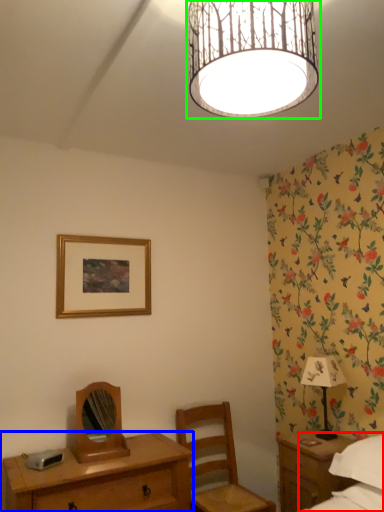
Question: Which object is positioned closest to bed (highlighted by a red box)? Select from desk (highlighted by a blue box) and lamp (highlighted by a green box).

Choices:
 (A) desk
 (B) lamp

Answer: (A)